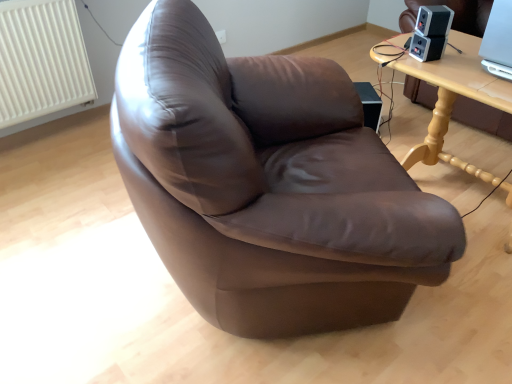
Question: Would you say white textured radiator at upper left is part of satin black speaker at upper right, the 2th speaker when ordered from top to bottom,'s contents?

Choices:
 (A) no
 (B) yes

Answer: (A)

Question: Is satin black speaker at upper right, the 2th speaker when ordered from top to bottom, positioned before white textured radiator at upper left?

Choices:
 (A) yes
 (B) no

Answer: (A)

Question: Is satin black speaker at upper right, the 1th speaker when ordered from bottom to top, positioned behind white textured radiator at upper left?

Choices:
 (A) no
 (B) yes

Answer: (A)

Question: From a real-world perspective, is satin black speaker at upper right, the 1th speaker when ordered from bottom to top, positioned over white textured radiator at upper left based on gravity?

Choices:
 (A) yes
 (B) no

Answer: (A)

Question: From a real-world perspective, does satin black speaker at upper right, the 2th speaker when ordered from top to bottom, sit lower than white textured radiator at upper left?

Choices:
 (A) yes
 (B) no

Answer: (B)

Question: From a real-world perspective, is light wood table at upper right positioned above or below black plastic speaker at upper right, acting as the first speaker starting from the top?

Choices:
 (A) below
 (B) above

Answer: (A)

Question: From the image's perspective, is light wood table at upper right positioned above or below black plastic speaker at upper right, acting as the first speaker starting from the top?

Choices:
 (A) above
 (B) below

Answer: (B)

Question: Is light wood table at upper right situated inside black plastic speaker at upper right, which ranks as the second speaker in bottom-to-top order, or outside?

Choices:
 (A) inside
 (B) outside

Answer: (B)

Question: In terms of size, does light wood table at upper right appear bigger or smaller than black plastic speaker at upper right, which ranks as the second speaker in bottom-to-top order?

Choices:
 (A) big
 (B) small

Answer: (A)

Question: Considering the positions of point (441, 33) and point (44, 79), is point (441, 33) closer or farther from the camera than point (44, 79)?

Choices:
 (A) closer
 (B) farther

Answer: (A)

Question: Is black plastic speaker at upper right, which ranks as the second speaker in bottom-to-top order, situated inside white textured radiator at upper left or outside?

Choices:
 (A) outside
 (B) inside

Answer: (A)

Question: From the image's perspective, is black plastic speaker at upper right, which ranks as the second speaker in bottom-to-top order, positioned above or below white textured radiator at upper left?

Choices:
 (A) above
 (B) below

Answer: (B)

Question: Is black plastic speaker at upper right, acting as the first speaker starting from the top, taller or shorter than white textured radiator at upper left?

Choices:
 (A) tall
 (B) short

Answer: (B)

Question: Is satin black speaker at upper right, the 2th speaker when ordered from top to bottom, bigger or smaller than white textured radiator at upper left?

Choices:
 (A) big
 (B) small

Answer: (B)

Question: Considering their positions, is satin black speaker at upper right, the 1th speaker when ordered from bottom to top, located in front of or behind white textured radiator at upper left?

Choices:
 (A) front
 (B) behind

Answer: (A)